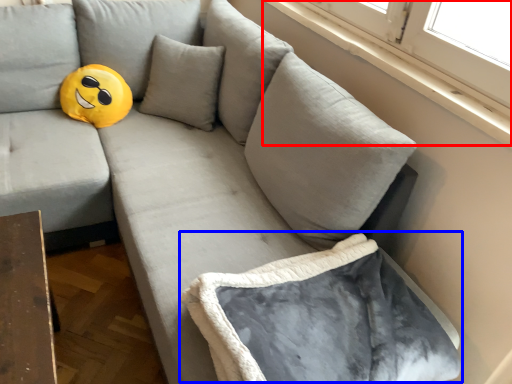
Question: Among these objects, which one is nearest to the camera, window sill (highlighted by a red box) or bean bag chair (highlighted by a blue box)?

Choices:
 (A) window sill
 (B) bean bag chair

Answer: (B)